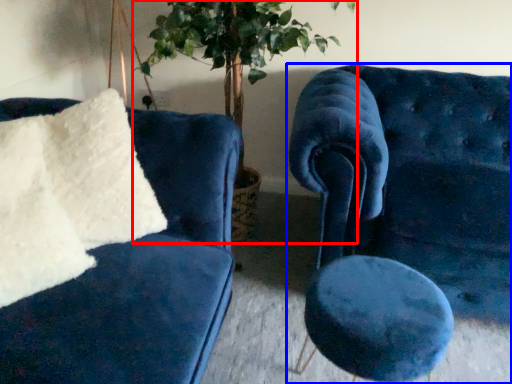
Question: Which of the following is the closest to the observer, houseplant (highlighted by a red box) or chair (highlighted by a blue box)?

Choices:
 (A) houseplant
 (B) chair

Answer: (B)